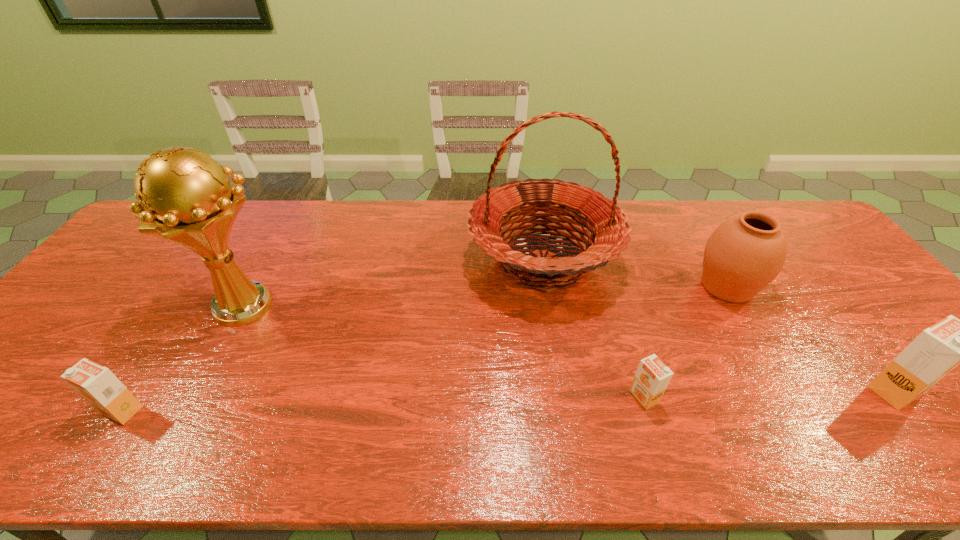
To make them evenly spaced by inserting another orange_juice among them, please locate a vacant spot for this new orange_juice. Please provide its 2D coordinates. Your answer should be formatted as a tuple, i.e. [(x, y)], where the tuple contains the x and y coordinates of a point satisfying the conditions above.

[(386, 403)]